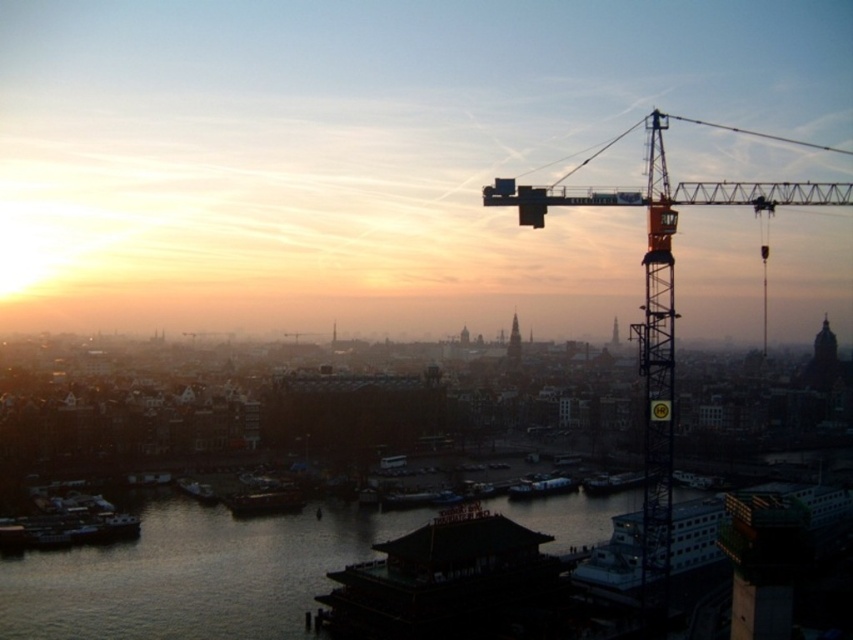
Question: Which point is closer to the camera taking this photo?

Choices:
 (A) (616, 499)
 (B) (39, 544)

Answer: (B)

Question: Can you confirm if wooden boat at lower center is thinner than metallic silver boat at lower left?

Choices:
 (A) no
 (B) yes

Answer: (A)

Question: Estimate the real-world distances between objects in this image. Which object is closer to the orange metallic crane at upper right?

Choices:
 (A) metallic silver boat at lower left
 (B) metallic silver boat at center

Answer: (B)

Question: Can you confirm if metallic gray boat at lower center is positioned above metallic silver boat at lower left?

Choices:
 (A) yes
 (B) no

Answer: (B)

Question: Is orange metallic crane at upper right in front of metallic silver boat at lower left?

Choices:
 (A) yes
 (B) no

Answer: (A)

Question: Which point is closer to the camera taking this photo?

Choices:
 (A) (103, 538)
 (B) (543, 476)
 (C) (440, 496)

Answer: (A)